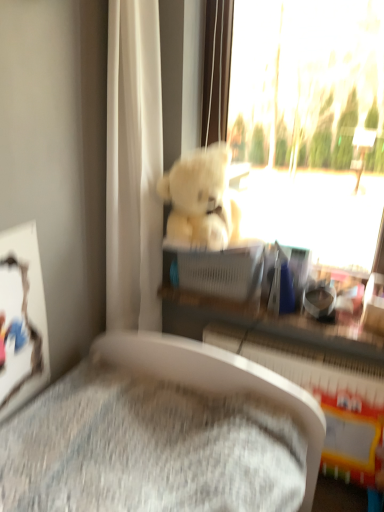
Question: Is white plastic radiator at lower center to the right of white plush bear at upper center from the viewer's perspective?

Choices:
 (A) yes
 (B) no

Answer: (B)

Question: From a real-world perspective, is white plastic radiator at lower center physically below white plush bear at upper center?

Choices:
 (A) no
 (B) yes

Answer: (B)

Question: From the image's perspective, is white plastic radiator at lower center over white plush bear at upper center?

Choices:
 (A) no
 (B) yes

Answer: (A)

Question: Can you confirm if white plastic radiator at lower center is shorter than white plush bear at upper center?

Choices:
 (A) no
 (B) yes

Answer: (B)

Question: Is white plastic radiator at lower center turned away from white plush bear at upper center?

Choices:
 (A) yes
 (B) no

Answer: (B)

Question: Is point (200, 305) positioned closer to the camera than point (119, 291)?

Choices:
 (A) closer
 (B) farther

Answer: (B)

Question: From their relative heights in the image, would you say matte plastic shelf at center is taller or shorter than white fabric curtain at upper center?

Choices:
 (A) short
 (B) tall

Answer: (A)

Question: In terms of width, does matte plastic shelf at center look wider or thinner when compared to white fabric curtain at upper center?

Choices:
 (A) wide
 (B) thin

Answer: (B)

Question: Considering their positions, is matte plastic shelf at center located in front of or behind white fabric curtain at upper center?

Choices:
 (A) behind
 (B) front

Answer: (A)

Question: Looking at their shapes, would you say white plush bear at upper center is wider or thinner than matte plastic shelf at center?

Choices:
 (A) wide
 (B) thin

Answer: (A)

Question: From the image's perspective, is white plush bear at upper center positioned above or below matte plastic shelf at center?

Choices:
 (A) below
 (B) above

Answer: (B)

Question: In the image, is white plush bear at upper center positioned in front of or behind matte plastic shelf at center?

Choices:
 (A) behind
 (B) front

Answer: (B)

Question: Do you think white plush bear at upper center is within matte plastic shelf at center, or outside of it?

Choices:
 (A) outside
 (B) inside

Answer: (A)

Question: In the image, is white plastic radiator at lower center on the left side or the right side of white plush bear at upper center?

Choices:
 (A) left
 (B) right

Answer: (A)

Question: From a real-world perspective, is white plastic radiator at lower center physically located above or below white plush bear at upper center?

Choices:
 (A) below
 (B) above

Answer: (A)